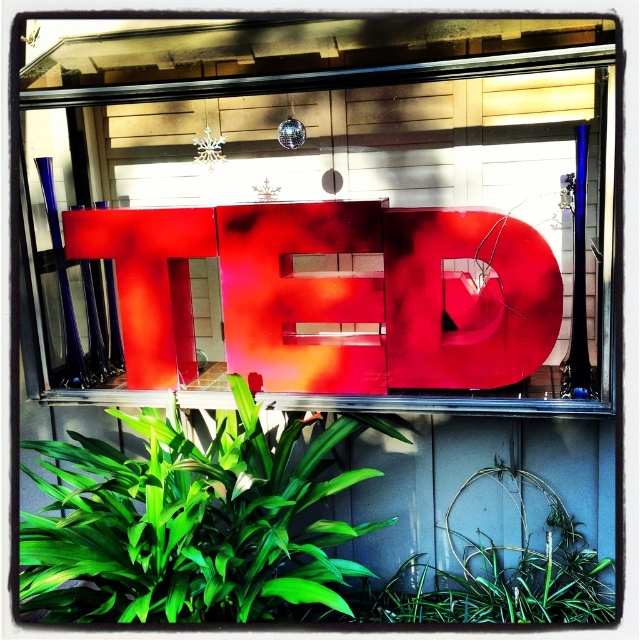
What do you see at coordinates (333, 292) in the screenshot? The image size is (640, 640). I see `glossy plastic letter at center` at bounding box center [333, 292].

The image size is (640, 640). I want to click on glossy plastic letter at center, so click(333, 292).

Is point (436, 209) more distant than point (296, 566)?

No.

Who is lower down, glossy plastic letter at center or green leafy plant at lower left?

green leafy plant at lower left is lower down.

You are a GUI agent. You are given a task and a screenshot of the screen. Output one action in this format:
    pyautogui.click(x=<x>, y=<y>)
    Task: Click on the glossy plastic letter at center
    Image resolution: width=640 pixels, height=640 pixels.
    Given the screenshot: What is the action you would take?
    pyautogui.click(x=333, y=292)

Can you confirm if green leafy plant at lower left is positioned to the right of green leafy plant at lower center?

No, green leafy plant at lower left is not to the right of green leafy plant at lower center.

Who is more distant from viewer, (292,554) or (400,616)?

Positioned behind is point (292,554).

What do you see at coordinates (189, 522) in the screenshot?
I see `green leafy plant at lower left` at bounding box center [189, 522].

At what (x,y) coordinates should I click in order to perform the action: click on green leafy plant at lower left. Please return your answer as a coordinate pair (x, y). Looking at the image, I should click on [189, 522].